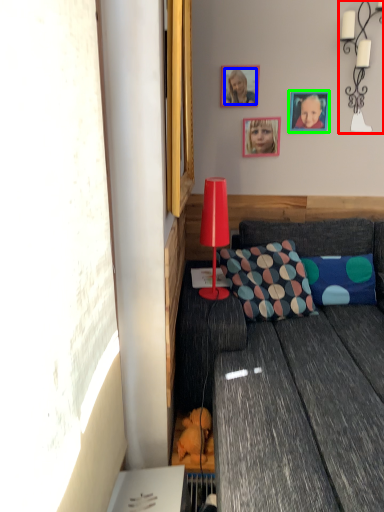
Question: Which object is the farthest from lamp (highlighted by a red box)? Choose among these: person (highlighted by a blue box) or picture frame (highlighted by a green box).

Choices:
 (A) person
 (B) picture frame

Answer: (A)